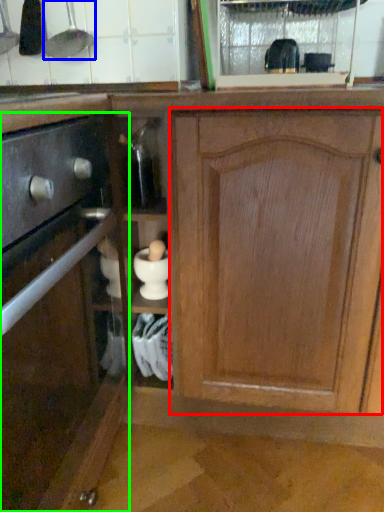
Question: Based on their relative distances, which object is farther from cabinetry (highlighted by a red box)? Choose from appliance (highlighted by a blue box) and cabinetry (highlighted by a green box).

Choices:
 (A) appliance
 (B) cabinetry

Answer: (A)